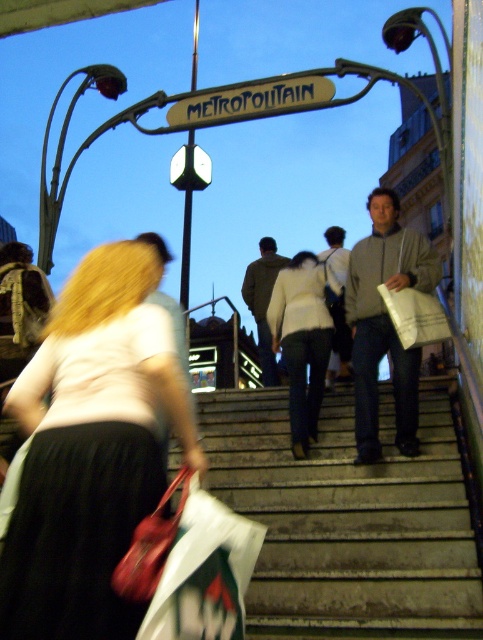
You are standing at the bottom of the metro station stairs and see two points marked in the image. The first point is at coordinate point (144, 483) and the second is at point (176, 125). Which point is closer to you?

Point (144, 483) is in front of point (176, 125), so it is closer to you.

A photographer is standing at the point marked at (311, 252) in the image. They want to capture a wide shot of the metro station entrance while including the woman in the foreground and the METROPOLITAN sign above the stairs. Given the distance between the photographer and the sign, will they need to move closer or farther away to ensure both the woman and the sign are in focus?

The photographer needs to move closer to ensure both the woman in the foreground and the METROPOLITAN sign are in focus since they are 355.54 feet apart, which is beyond the typical depth of field range for most cameras.